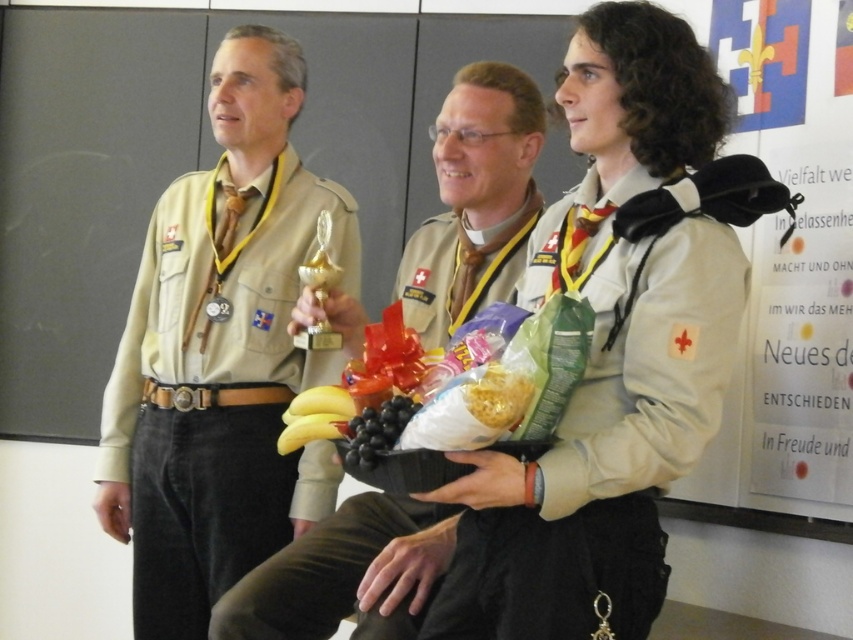
You are organizing a scout meeting and need to place a snack on a table that can only hold items smaller than the scout uniforms. Can the shiny golden snack at center be placed on the table if the khaki uniform at center is already there?

The khaki uniform at center is larger in size than the shiny golden snack at center. Since the table can only hold items smaller than the scout uniforms, the shiny golden snack at center can be placed on the table because it is smaller than the khaki uniform at center.